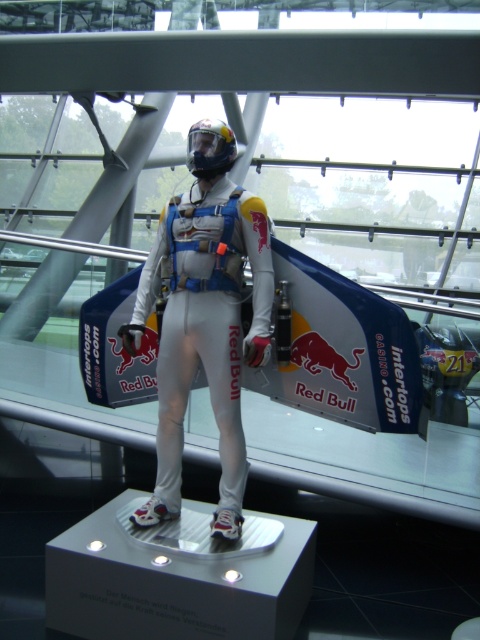
You are a safety inspector checking the display setup. The safety protocol requires that all exhibits must be at least 3 meters away from visitors to prevent accidental contact. Is the white matte suit at center compliant with this regulation?

The white matte suit at center is only 2.96 meters away from the viewer, which is less than the required 3 meters. Therefore, it does not comply with the safety protocol.

You are an athlete preparing for a skydive and need to ensure your equipment fits properly. You have a white matte suit at center and a glossy plastic helmet at center. Which piece of equipment is wider?

The white matte suit at center is wider than the glossy plastic helmet at center according to the description.

You are an inspector checking the mannequin setup in the exhibit. You need to ensure that the white matte suit at center is positioned above the glossy plastic helmet at center. Based on the current arrangement, is this requirement met?

The white matte suit at center is located below the glossy plastic helmet at center, so the requirement is not met.